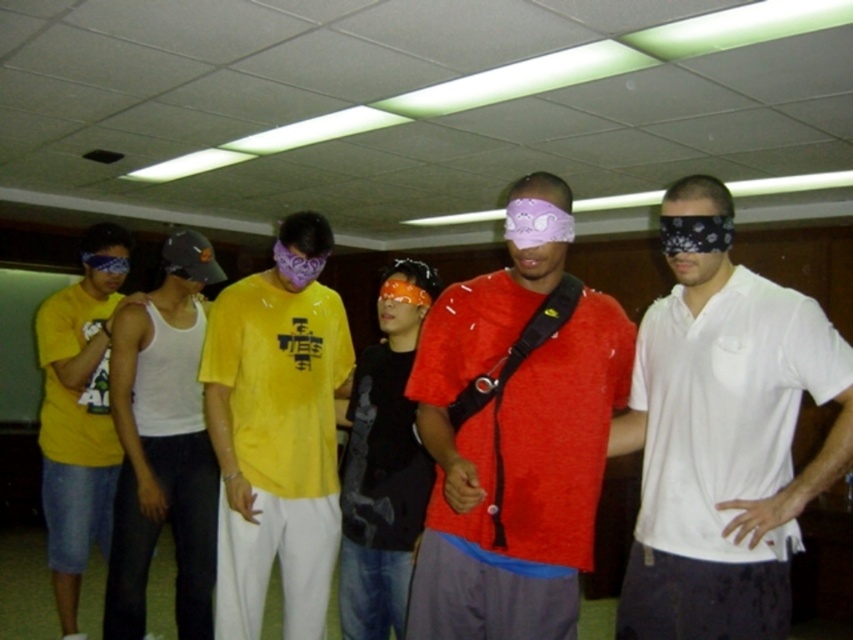
Which is more to the left, matte yellow t-shirt at center or orange matte mask at center?

From the viewer's perspective, matte yellow t-shirt at center appears more on the left side.

You are a GUI agent. You are given a task and a screenshot of the screen. Output one action in this format:
    pyautogui.click(x=<x>, y=<y>)
    Task: Click on the matte yellow t-shirt at center
    The height and width of the screenshot is (640, 853).
    Given the screenshot: What is the action you would take?
    pyautogui.click(x=274, y=445)

The image size is (853, 640). Identify the location of matte yellow t-shirt at center. 274,445.

Which is in front, point (404, 321) or point (91, 268)?

Point (404, 321)

Does orange matte mask at center come behind matte purple bandana at center?

No, orange matte mask at center is in front of matte purple bandana at center.

Based on the photo, who is more distant from viewer, (381, 300) or (108, 268)?

The point (108, 268) is behind.

You are a GUI agent. You are given a task and a screenshot of the screen. Output one action in this format:
    pyautogui.click(x=<x>, y=<y>)
    Task: Click on the orange matte mask at center
    
    Given the screenshot: What is the action you would take?
    pyautogui.click(x=402, y=291)

Does matte red shirt at center come behind orange matte mask at center?

No, matte red shirt at center is in front of orange matte mask at center.

Is point (566, 566) closer to camera compared to point (399, 280)?

Yes, point (566, 566) is in front of point (399, 280).

Locate an element on the screen. This screenshot has width=853, height=640. matte red shirt at center is located at coordinates (512, 461).